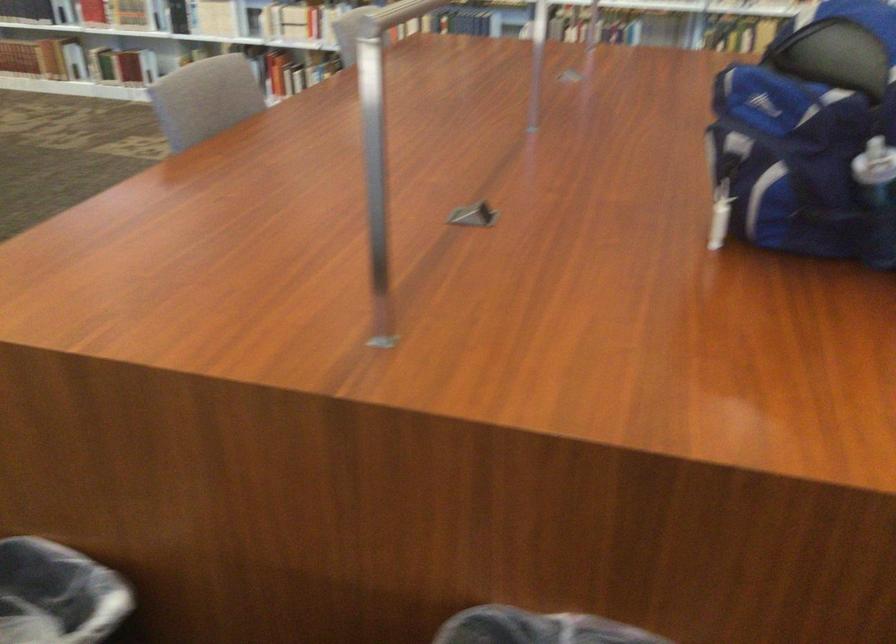
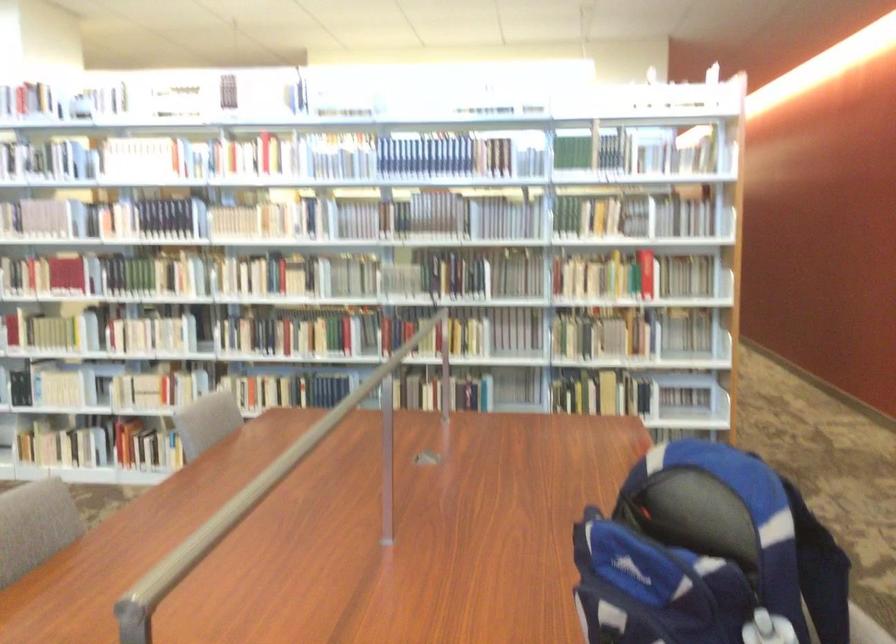
In a continuous first-person perspective shot, in which direction is the camera moving?

The cameraman moved toward right, forward.